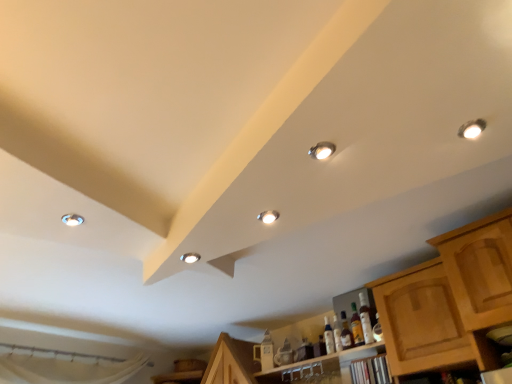
Question: Considering the relative positions of translucent glass bottle at center, the 1th bottle viewed from the right, and matte silver droplight at center, the fourth droplight when ordered from top to bottom, in the image provided, is translucent glass bottle at center, the 1th bottle viewed from the right, to the right of matte silver droplight at center, the fourth droplight when ordered from top to bottom, from the viewer's perspective?

Choices:
 (A) no
 (B) yes

Answer: (B)

Question: Is translucent glass bottle at center, the 1th bottle viewed from the right, smaller than matte silver droplight at center, arranged as the first droplight when ordered from the bottom?

Choices:
 (A) yes
 (B) no

Answer: (B)

Question: Is translucent glass bottle at center, which appears as the 3th bottle when viewed from the left, not close to matte silver droplight at center, placed as the 4th droplight when sorted from front to back?

Choices:
 (A) no
 (B) yes

Answer: (B)

Question: Would you say translucent glass bottle at center, the 1th bottle viewed from the right, contains matte silver droplight at center, which ranks as the third droplight in right-to-left order?

Choices:
 (A) yes
 (B) no

Answer: (B)

Question: Is translucent glass bottle at center, the 1th bottle viewed from the right, shorter than matte silver droplight at center, the second droplight in the left-to-right sequence?

Choices:
 (A) no
 (B) yes

Answer: (A)

Question: Is translucent glass bottle at center, which appears as the 3th bottle when viewed from the left, to the left of matte silver droplight at center, placed as the 4th droplight when sorted from front to back, from the viewer's perspective?

Choices:
 (A) yes
 (B) no

Answer: (B)

Question: Is translucent glass bottle at center, the 1th bottle viewed from the right, located outside matte silver droplight at upper right, arranged as the 1th droplight when viewed from the right?

Choices:
 (A) yes
 (B) no

Answer: (A)

Question: Does translucent glass bottle at center, which appears as the 3th bottle when viewed from the left, have a smaller size compared to matte silver droplight at upper right, marked as the 1th droplight in a top-to-bottom arrangement?

Choices:
 (A) no
 (B) yes

Answer: (A)

Question: Could you tell me if translucent glass bottle at center, the 1th bottle viewed from the right, is turned towards matte silver droplight at upper right, arranged as the 1th droplight when viewed from the right?

Choices:
 (A) yes
 (B) no

Answer: (B)

Question: Does translucent glass bottle at center, the 1th bottle viewed from the right, have a lesser height compared to matte silver droplight at upper right, marked as the 1th droplight in a top-to-bottom arrangement?

Choices:
 (A) no
 (B) yes

Answer: (A)

Question: Is the depth of translucent glass bottle at center, which appears as the 3th bottle when viewed from the left, greater than that of matte silver droplight at upper right, marked as the 1th droplight in a top-to-bottom arrangement?

Choices:
 (A) yes
 (B) no

Answer: (A)

Question: Is translucent glass bottle at center, the 1th bottle viewed from the right, taller than matte silver droplight at upper right, arranged as the fourth droplight when viewed from the back?

Choices:
 (A) no
 (B) yes

Answer: (B)

Question: From a real-world perspective, is clear glass bottle at lower center, the 3th bottle when ordered from right to left, physically below matte white droplight at upper left, which is the 3th droplight from front to back?

Choices:
 (A) no
 (B) yes

Answer: (B)